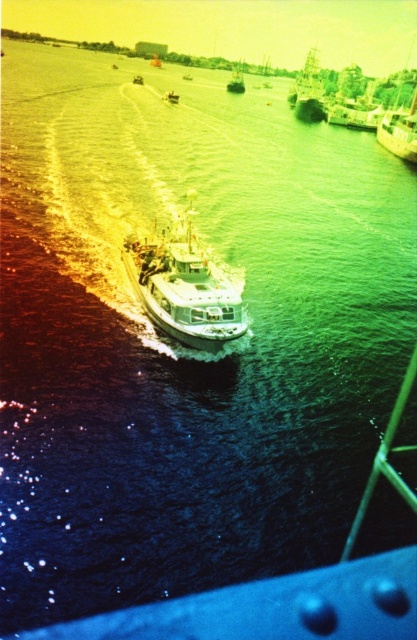
Question: Among these points, which one is farthest from the camera?

Choices:
 (A) (241, 77)
 (B) (190, 326)

Answer: (A)

Question: Which of the following is the farthest from the observer?

Choices:
 (A) (318, 72)
 (B) (233, 77)
 (C) (208, 305)
 (D) (381, 145)

Answer: (B)

Question: Is white glossy boat at center to the left of shiny silver boat at upper right from the viewer's perspective?

Choices:
 (A) yes
 (B) no

Answer: (A)

Question: Which point is farther to the camera?

Choices:
 (A) (401, 156)
 (B) (233, 86)

Answer: (B)

Question: Does white glossy boat at center appear under metallic silver boat at center?

Choices:
 (A) no
 (B) yes

Answer: (B)

Question: Does metallic silver boat at upper right appear under metallic silver boat at center?

Choices:
 (A) no
 (B) yes

Answer: (B)